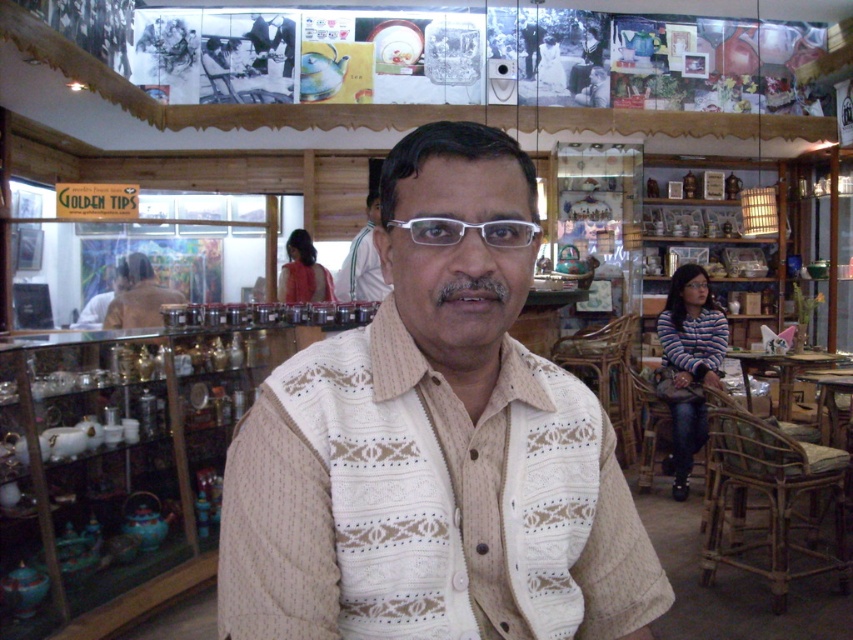
You are a customer in the shop and want to touch both the white knitted sweater at center and the white textured shirt at center. Which one is on the right side when facing the man?

The white knitted sweater at center is positioned on the right side of the white textured shirt at center, so when facing the man, the white knitted sweater at center is on the right side.

In the scene shown: You are a customer in the shop and want to grab the clear plastic glasses at center. Which direction should you look relative to the white textured shirt at center?

The clear plastic glasses at center is located below the white textured shirt at center, so you should look downward from the white textured shirt at center to find them.

You are standing in the shop and want to place a small decorative item on the white knitted sweater at center. Based on its position, is the sweater located closer to the left or right side of the image?

The white knitted sweater at center is located at point 0.703 on the horizontal axis, which means it is closer to the right side of the image.